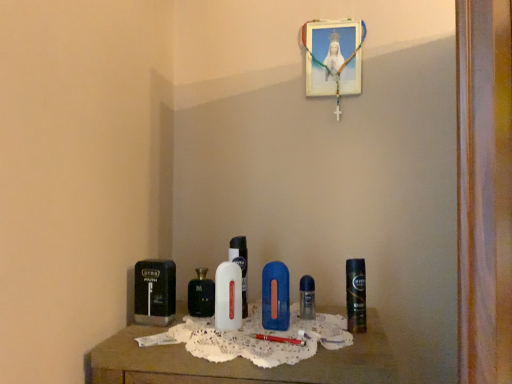
You are a GUI agent. You are given a task and a screenshot of the screen. Output one action in this format:
    pyautogui.click(x=<x>, y=<y>)
    Task: Click on the free space to the left of blue plastic razor at center, the 2th personal care from the left
    This screenshot has width=512, height=384.
    Given the screenshot: What is the action you would take?
    pyautogui.click(x=205, y=331)